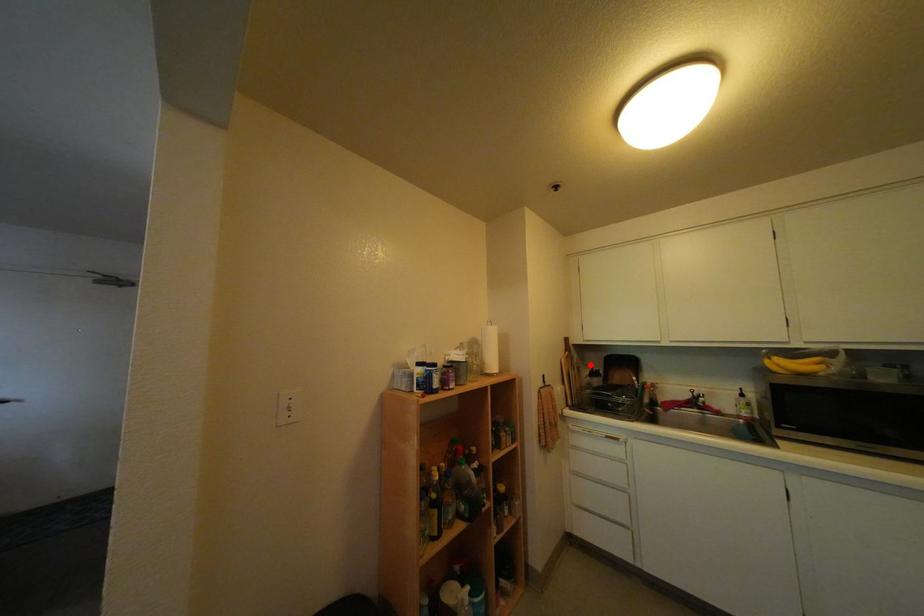
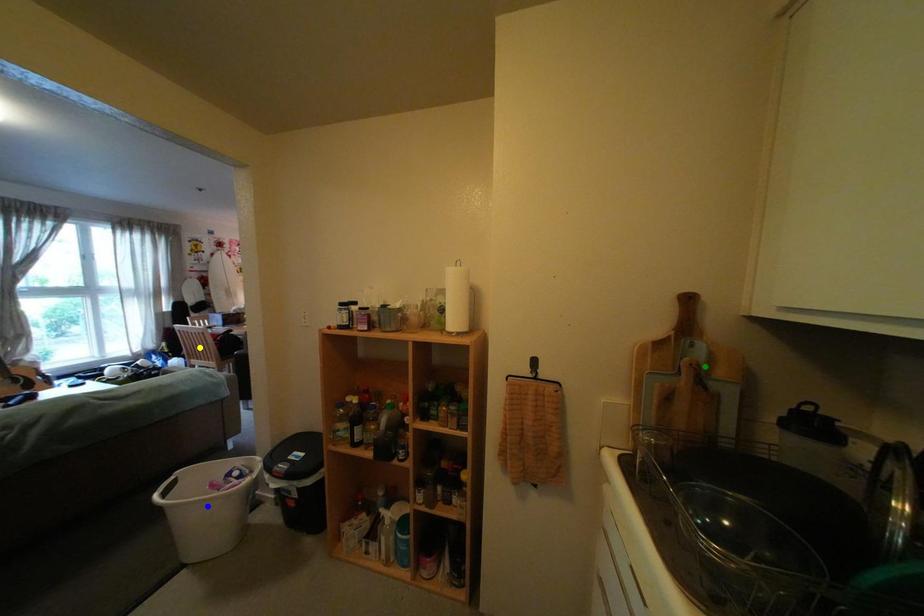
Question: I am providing you with two images of the same scene from different viewpoints. A red point is marked on the first image. You are given multiple points on the second image. Which point in image 2 represents the same 3d spot as the red point in image 1?

Choices:
 (A) blue point
 (B) yellow point
 (C) green point

Answer: (C)